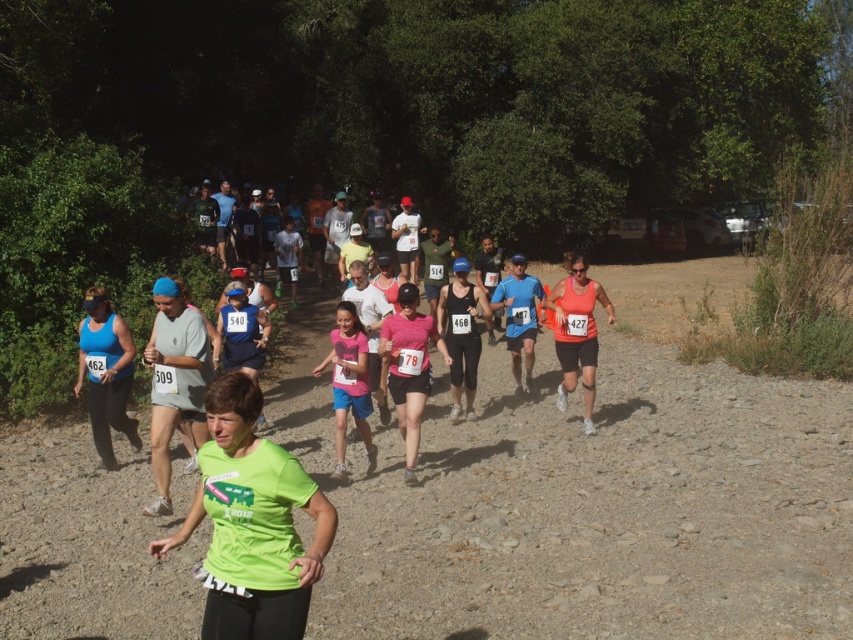
Question: Among these points, which one is farthest from the camera?

Choices:
 (A) (393, 316)
 (B) (839, 547)

Answer: (A)

Question: Can you confirm if matte blue tank top at left is positioned above orange matte tank top at center?

Choices:
 (A) no
 (B) yes

Answer: (A)

Question: Can you confirm if brown gravel path at center is positioned to the right of matte blue tank top at left?

Choices:
 (A) yes
 (B) no

Answer: (A)

Question: Which object is closer to the camera taking this photo?

Choices:
 (A) pink matte tank top at center
 (B) orange matte tank top at center

Answer: (A)

Question: Which of the following is the closest to the observer?

Choices:
 (A) (585, 433)
 (B) (444, 348)
 (C) (131, 440)
 (D) (650, 397)

Answer: (B)

Question: Does brown gravel path at center appear over matte blue tank top at left?

Choices:
 (A) no
 (B) yes

Answer: (A)